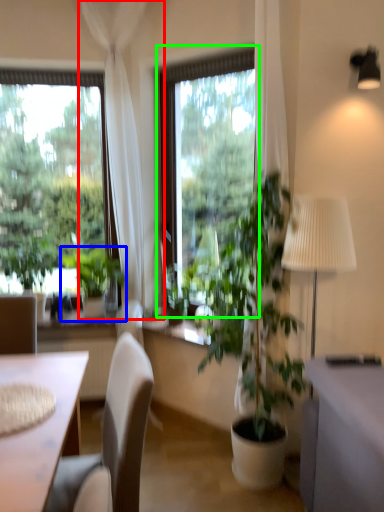
Question: Based on their relative distances, which object is farther from curtain (highlighted by a red box)? Choose from houseplant (highlighted by a blue box) and window (highlighted by a green box).

Choices:
 (A) houseplant
 (B) window

Answer: (A)